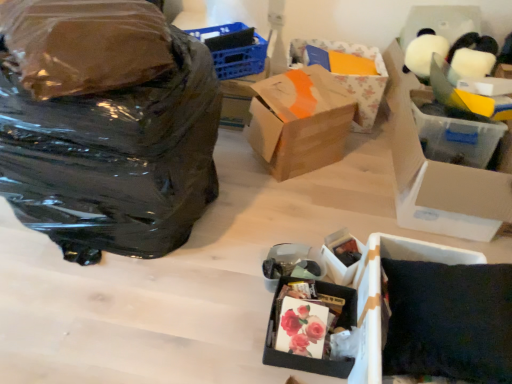
Identify the location of free space between brown cardboard box at center, which ranks as the 2th box in top-to-bottom order, and white cardboard box at upper right, which ranks as the third box in bottom-to-top order. (342, 183).